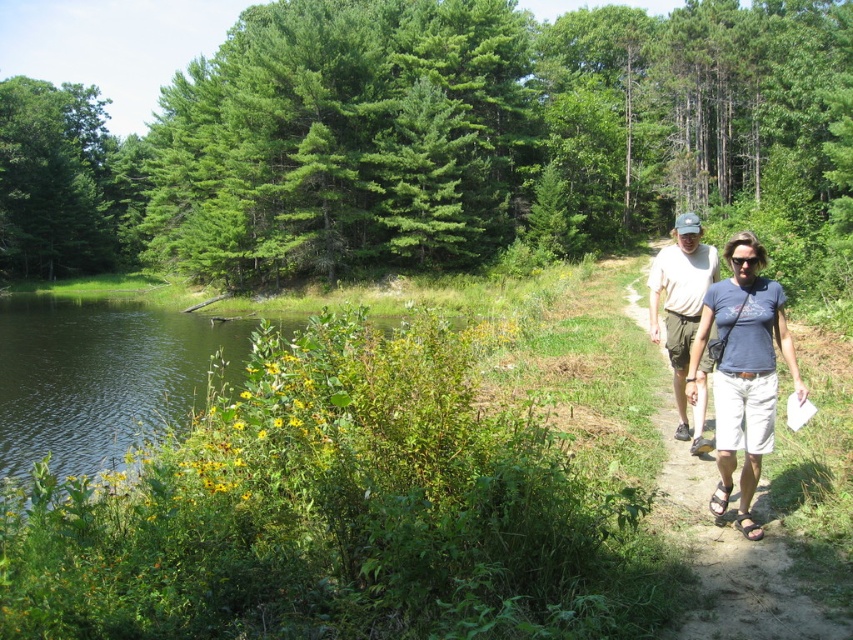
Is green leafy water at lower left bigger than blue cotton shirt at right?

Correct, green leafy water at lower left is larger in size than blue cotton shirt at right.

Where is `green leafy water at lower left`? green leafy water at lower left is located at coordinates (97, 374).

Is blue cotton shirt at right taller than light brown shorts at right?

No.

Between blue cotton shirt at right and light brown shorts at right, which one is positioned higher?

blue cotton shirt at right

Locate an element on the screen. The image size is (853, 640). blue cotton shirt at right is located at coordinates (741, 369).

At what (x,y) coordinates should I click in order to perform the action: click on blue cotton shirt at right. Please return your answer as a coordinate pair (x, y). This screenshot has height=640, width=853. Looking at the image, I should click on (741, 369).

Measure the distance between green leafy water at lower left and camera.

A distance of 13.03 meters exists between green leafy water at lower left and camera.

In order to click on green leafy water at lower left in this screenshot , I will do `click(97, 374)`.